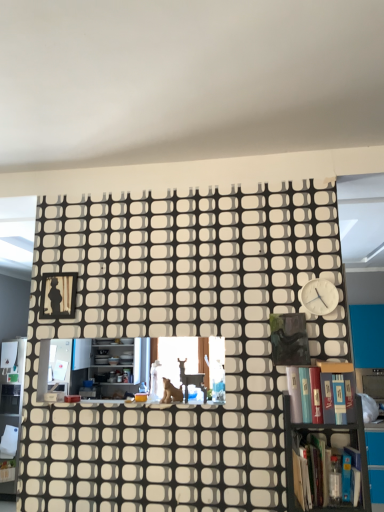
Question: Which direction should I rotate to look at wooden bookcase at center, which is counted as the 2th bookcase, starting from the front, — up or down?

Choices:
 (A) up
 (B) down

Answer: (B)

Question: From a real-world perspective, is white matte clock at upper right physically above wooden bookcase at center, which is counted as the 2th bookcase, starting from the front?

Choices:
 (A) no
 (B) yes

Answer: (B)

Question: Can you confirm if white matte clock at upper right is wider than wooden bookcase at center, which ranks as the first bookcase in back-to-front order?

Choices:
 (A) yes
 (B) no

Answer: (A)

Question: Is white matte clock at upper right next to wooden bookcase at center, which ranks as the first bookcase in back-to-front order?

Choices:
 (A) yes
 (B) no

Answer: (B)

Question: From the image's perspective, is white matte clock at upper right over wooden bookcase at center, which ranks as the first bookcase in back-to-front order?

Choices:
 (A) yes
 (B) no

Answer: (A)

Question: Can you confirm if white matte clock at upper right is bigger than wooden bookcase at center, which is counted as the 2th bookcase, starting from the front?

Choices:
 (A) no
 (B) yes

Answer: (A)

Question: Can you confirm if white matte clock at upper right is positioned to the right of wooden bookcase at center, which is counted as the 2th bookcase, starting from the front?

Choices:
 (A) yes
 (B) no

Answer: (A)

Question: Is brown fur cat at center located outside wooden bookcase at center, which is counted as the 2th bookcase, starting from the front?

Choices:
 (A) yes
 (B) no

Answer: (A)

Question: Can you confirm if brown fur cat at center is thinner than wooden bookcase at center, which is counted as the 2th bookcase, starting from the front?

Choices:
 (A) no
 (B) yes

Answer: (A)

Question: Can you confirm if brown fur cat at center is positioned to the left of wooden bookcase at center, which is counted as the 2th bookcase, starting from the front?

Choices:
 (A) no
 (B) yes

Answer: (B)

Question: Can you confirm if brown fur cat at center is smaller than wooden bookcase at center, which ranks as the first bookcase in back-to-front order?

Choices:
 (A) no
 (B) yes

Answer: (B)

Question: From the image's perspective, is brown fur cat at center on top of wooden bookcase at center, which is counted as the 2th bookcase, starting from the front?

Choices:
 (A) no
 (B) yes

Answer: (A)

Question: Does brown fur cat at center lie behind wooden bookcase at center, which is counted as the 2th bookcase, starting from the front?

Choices:
 (A) yes
 (B) no

Answer: (A)

Question: Considering the relative sizes of hardcover book at lower right, which appears as the second book when viewed from the top, and hardcover book at right, which is counted as the 2th book, starting from the bottom, in the image provided, is hardcover book at lower right, which appears as the second book when viewed from the top, wider than hardcover book at right, which is counted as the 2th book, starting from the bottom,?

Choices:
 (A) yes
 (B) no

Answer: (A)